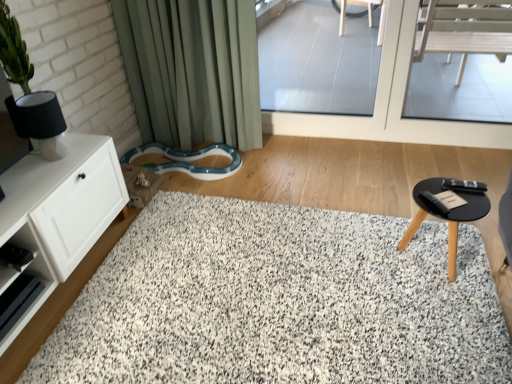
I want to click on free space in front of black matte lampshade at upper left, so click(x=38, y=176).